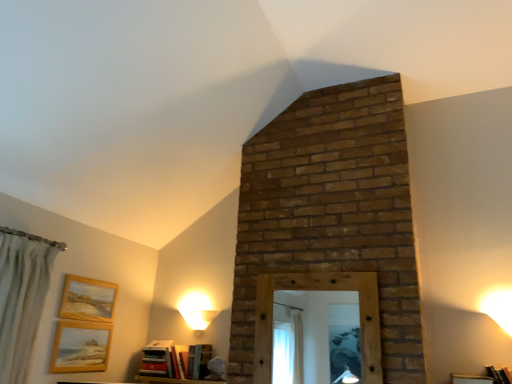
Find the location of `wooden picture frame at lower left, acting as the 2th picture frame starting from the top`. wooden picture frame at lower left, acting as the 2th picture frame starting from the top is located at coordinates (80, 347).

What do you see at coordinates (175, 360) in the screenshot? The height and width of the screenshot is (384, 512). I see `hardcover books at lower center, the 2th book when ordered from right to left` at bounding box center [175, 360].

This screenshot has width=512, height=384. I want to click on hardcover books at lower center, the 2th book when ordered from right to left, so point(175,360).

This screenshot has height=384, width=512. What do you see at coordinates (157, 359) in the screenshot?
I see `matte red book at lower left, which ranks as the 1th book in left-to-right order` at bounding box center [157, 359].

What do you see at coordinates (21, 297) in the screenshot? This screenshot has height=384, width=512. I see `green textured curtain at left` at bounding box center [21, 297].

This screenshot has width=512, height=384. Describe the element at coordinates (87, 299) in the screenshot. I see `wooden picture frame at upper left, the first picture frame in the top-to-bottom sequence` at that location.

Where is `wooden bookshelf at lower center, the first furniture positioned from the bottom`? This screenshot has height=384, width=512. wooden bookshelf at lower center, the first furniture positioned from the bottom is located at coordinates (174, 380).

Describe the element at coordinates (198, 361) in the screenshot. The width and height of the screenshot is (512, 384). I see `hardcover book at center, which ranks as the 3th book in left-to-right order` at that location.

This screenshot has height=384, width=512. I want to click on wooden frame at lower right, marked as the first furniture in a front-to-back arrangement, so click(x=470, y=379).

Identify the location of wooden picture frame at lower left, acting as the 2th picture frame starting from the top. The width and height of the screenshot is (512, 384). (80, 347).

Is hardcover books at lower center, the 2th book when ordered from right to left, at the left side of wooden picture frame at lower left, the 1th picture frame from the bottom?

No, hardcover books at lower center, the 2th book when ordered from right to left, is not to the left of wooden picture frame at lower left, the 1th picture frame from the bottom.

Which is in front, point (170, 362) or point (106, 348)?

The point (106, 348) is more forward.

Measure the distance between hardcover books at lower center, acting as the second book starting from the left, and wooden picture frame at lower left, the 1th picture frame from the bottom.

21.39 inches.

In the scene shown: Can you confirm if hardcover books at lower center, acting as the second book starting from the left, is bigger than wooden picture frame at lower left, acting as the 2th picture frame starting from the top?

Yes, hardcover books at lower center, acting as the second book starting from the left, is bigger than wooden picture frame at lower left, acting as the 2th picture frame starting from the top.

From the image's perspective, which is above, hardcover book at center, which ranks as the 3th book in left-to-right order, or white glossy table lamp at lower left?

white glossy table lamp at lower left is shown above in the image.

Considering the relative sizes of hardcover book at center, which ranks as the 3th book in left-to-right order, and white glossy table lamp at lower left in the image provided, is hardcover book at center, which ranks as the 3th book in left-to-right order, smaller than white glossy table lamp at lower left?

Yes.

Which of these two, hardcover book at center, acting as the first book starting from the right, or white glossy table lamp at lower left, is wider?

hardcover book at center, acting as the first book starting from the right.

Is hardcover book at center, acting as the first book starting from the right, touching white glossy table lamp at lower left?

No.

Are wooden mirror at center and wooden bookshelf at lower center, which appears as the 1th furniture when viewed from the back, beside each other?

No.

In terms of height, does wooden mirror at center look taller or shorter compared to wooden bookshelf at lower center, the second furniture positioned from the right?

wooden mirror at center is taller than wooden bookshelf at lower center, the second furniture positioned from the right.

Is wooden mirror at center positioned with its back to wooden bookshelf at lower center, which appears as the 1th furniture when viewed from the back?

No, wooden mirror at center is not facing away from wooden bookshelf at lower center, which appears as the 1th furniture when viewed from the back.

Where is `the 2nd furniture below when counting from the wooden mirror at center (from the image's perspective)`? Image resolution: width=512 pixels, height=384 pixels. the 2nd furniture below when counting from the wooden mirror at center (from the image's perspective) is located at coordinates (174, 380).

Which is closer to the camera, (150, 364) or (1, 368)?

Point (150, 364) is farther from the camera than point (1, 368).

Is hardcover books at lower center, acting as the second book starting from the left, not inside green textured curtain at left?

Yes, hardcover books at lower center, acting as the second book starting from the left, is outside of green textured curtain at left.

Would you consider hardcover books at lower center, acting as the second book starting from the left, to be distant from green textured curtain at left?

Absolutely, hardcover books at lower center, acting as the second book starting from the left, is distant from green textured curtain at left.

Which object is positioned more to the left, hardcover books at lower center, acting as the second book starting from the left, or green textured curtain at left?

green textured curtain at left is more to the left.

Identify the location of curtain on the left of hardcover books at lower center, the 2th book when ordered from right to left. (21, 297).

Considering the sizes of objects green textured curtain at left and hardcover books at lower center, acting as the second book starting from the left, in the image provided, who is smaller, green textured curtain at left or hardcover books at lower center, acting as the second book starting from the left,?

hardcover books at lower center, acting as the second book starting from the left, is smaller.

From the image's perspective, who appears lower, green textured curtain at left or hardcover books at lower center, the 2th book when ordered from right to left?

hardcover books at lower center, the 2th book when ordered from right to left.

Between point (36, 247) and point (193, 346), which one is positioned in front?

Positioned in front is point (36, 247).

Is green textured curtain at left in front of white glossy table lamp at lower left?

Yes.

Is point (18, 361) closer or farther from the camera than point (205, 300)?

Point (18, 361) is closer to the camera than point (205, 300).

Is green textured curtain at left bigger than white glossy table lamp at lower left?

Yes.

Which of these two, green textured curtain at left or white glossy table lamp at lower left, stands taller?

With more height is green textured curtain at left.

Which is behind, point (96, 326) or point (264, 362)?

The point (96, 326) is farther from the camera.

Which object is positioned more to the right, wooden picture frame at lower left, acting as the 2th picture frame starting from the top, or wooden mirror at center?

Positioned to the right is wooden mirror at center.

Can wooden mirror at center be found inside wooden picture frame at lower left, the 1th picture frame from the bottom?

Actually, wooden mirror at center is outside wooden picture frame at lower left, the 1th picture frame from the bottom.

Considering the relative sizes of wooden picture frame at lower left, acting as the 2th picture frame starting from the top, and wooden mirror at center in the image provided, is wooden picture frame at lower left, acting as the 2th picture frame starting from the top, wider than wooden mirror at center?

Incorrect, the width of wooden picture frame at lower left, acting as the 2th picture frame starting from the top, does not surpass that of wooden mirror at center.

This screenshot has height=384, width=512. Identify the location of the 2nd book to the right of the wooden picture frame at lower left, the 1th picture frame from the bottom, starting your count from the anchor. (175, 360).

Locate an element on the screen. The height and width of the screenshot is (384, 512). the 2nd book positioned below the white glossy table lamp at lower left (from a real-world perspective) is located at coordinates (198, 361).

Based on their spatial positions, is hardcover book at center, which ranks as the 3th book in left-to-right order, or hardcover books at lower center, the 2th book when ordered from right to left, further from white glossy table lamp at lower left?

hardcover books at lower center, the 2th book when ordered from right to left, is positioned further to the anchor white glossy table lamp at lower left.

From the image, which object appears to be farther from matte red book at lower left, which is the 3th book in right-to-left order, wooden bookshelf at lower center, the second furniture positioned from the right, or wooden picture frame at lower left, acting as the 2th picture frame starting from the top?

The object further to matte red book at lower left, which is the 3th book in right-to-left order, is wooden picture frame at lower left, acting as the 2th picture frame starting from the top.

Which object lies nearer to the anchor point wooden mirror at center, hardcover book at center, which ranks as the 3th book in left-to-right order, or white glossy table lamp at lower left?

hardcover book at center, which ranks as the 3th book in left-to-right order, lies closer to wooden mirror at center than the other object.

When comparing their distances from wooden mirror at center, does wooden frame at lower right, marked as the second furniture in a back-to-front arrangement, or hardcover books at lower center, acting as the second book starting from the left, seem further?

hardcover books at lower center, acting as the second book starting from the left, lies further to wooden mirror at center than the other object.

When comparing their distances from wooden picture frame at lower left, acting as the 2th picture frame starting from the top, does hardcover books at lower center, the 2th book when ordered from right to left, or wooden bookshelf at lower center, the second furniture positioned from the right, seem closer?

The object closer to wooden picture frame at lower left, acting as the 2th picture frame starting from the top, is hardcover books at lower center, the 2th book when ordered from right to left.

When comparing their distances from matte red book at lower left, which ranks as the 1th book in left-to-right order, does wooden picture frame at upper left, arranged as the second picture frame when ordered from the bottom, or wooden bookshelf at lower center, the first furniture positioned from the bottom, seem closer?

wooden bookshelf at lower center, the first furniture positioned from the bottom, is positioned closer to the anchor matte red book at lower left, which ranks as the 1th book in left-to-right order.

From the image, which object appears to be nearer to wooden picture frame at upper left, the first picture frame in the top-to-bottom sequence, hardcover books at lower center, acting as the second book starting from the left, or wooden mirror at center?

hardcover books at lower center, acting as the second book starting from the left, is closer to wooden picture frame at upper left, the first picture frame in the top-to-bottom sequence.

Which object lies nearer to the anchor point wooden mirror at center, hardcover books at lower center, acting as the second book starting from the left, or green textured curtain at left?

hardcover books at lower center, acting as the second book starting from the left, is positioned closer to the anchor wooden mirror at center.

Locate an element on the screen. The height and width of the screenshot is (384, 512). table lamp between wooden picture frame at upper left, arranged as the second picture frame when ordered from the bottom, and wooden frame at lower right, marked as the second furniture in a back-to-front arrangement, in the horizontal direction is located at coordinates (197, 311).

At what (x,y) coordinates should I click in order to perform the action: click on window frame between hardcover books at lower center, acting as the second book starting from the left, and wooden frame at lower right, marked as the 1th furniture in a right-to-left arrangement, in the horizontal direction. Please return your answer as a coordinate pair (x, y). The image size is (512, 384). Looking at the image, I should click on (318, 290).

Identify the location of table lamp between wooden bookshelf at lower center, which is counted as the second furniture, starting from the top, and wooden mirror at center. The width and height of the screenshot is (512, 384). (197, 311).

Find the location of a particular element. Image resolution: width=512 pixels, height=384 pixels. furniture between wooden picture frame at lower left, the 1th picture frame from the bottom, and wooden frame at lower right, acting as the 2th furniture starting from the left is located at coordinates (174, 380).